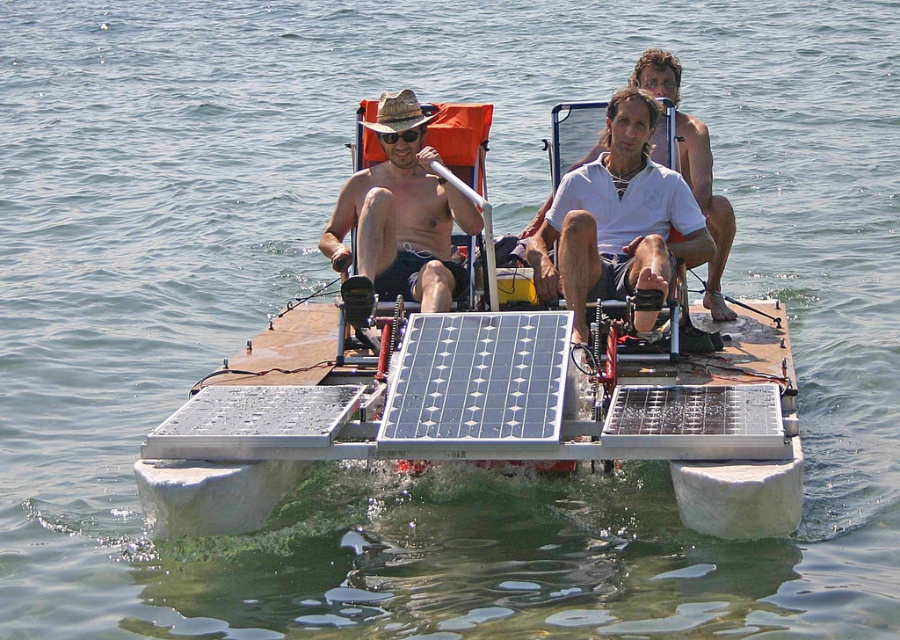
Who is more distant from viewer, (434, 368) or (716, 316)?

The point (716, 316) is behind.

Does silvery metallic solar panel at center appear on the left side of white matte shirt at center?

Correct, you'll find silvery metallic solar panel at center to the left of white matte shirt at center.

Describe the element at coordinates (477, 381) in the screenshot. The width and height of the screenshot is (900, 640). I see `silvery metallic solar panel at center` at that location.

The image size is (900, 640). I want to click on silvery metallic solar panel at center, so click(x=477, y=381).

Based on the photo, does silvery metallic solar panel at center have a smaller size compared to matte straw hat at center?

Yes, silvery metallic solar panel at center is smaller than matte straw hat at center.

Measure the distance between silvery metallic solar panel at center and camera.

silvery metallic solar panel at center is 179.32 feet from camera.

Where is `silvery metallic solar panel at center`? This screenshot has width=900, height=640. silvery metallic solar panel at center is located at coordinates (477, 381).

Based on the photo, can you confirm if white matte shirt at center is wider than matte black goggles at center?

Indeed, white matte shirt at center has a greater width compared to matte black goggles at center.

Can you confirm if white matte shirt at center is shorter than matte black goggles at center?

No, white matte shirt at center is not shorter than matte black goggles at center.

Who is more forward, [723,316] or [402,131]?

Positioned in front is point [402,131].

This screenshot has width=900, height=640. I want to click on white matte shirt at center, so click(x=677, y=116).